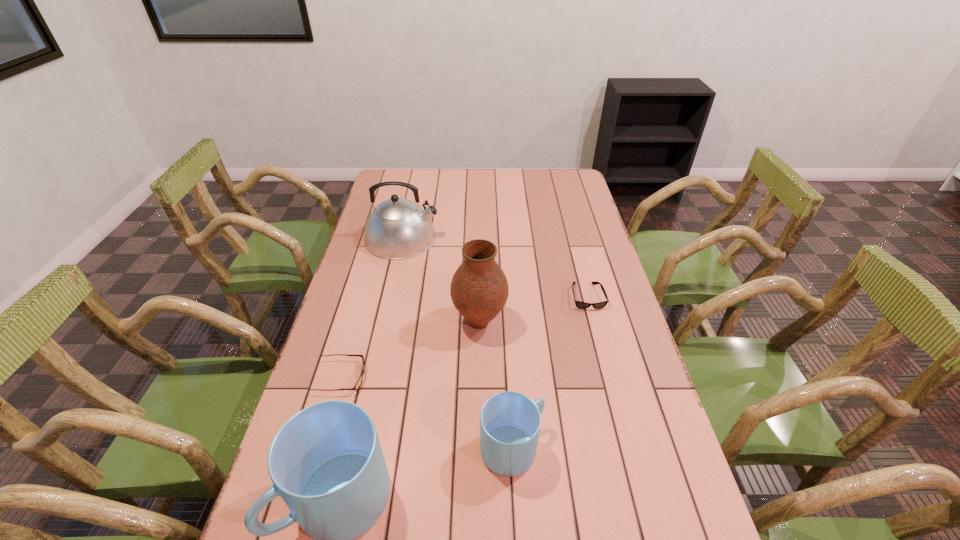
Image resolution: width=960 pixels, height=540 pixels. Find the location of `free spot between the nearer sunglasses and the fourth tallest object`. free spot between the nearer sunglasses and the fourth tallest object is located at coordinates (427, 413).

The image size is (960, 540). Identify the location of vacant area that lies between the vase and the third nearest object. (411, 350).

This screenshot has height=540, width=960. I want to click on vacant area that lies between the vase and the kettle, so click(441, 280).

Image resolution: width=960 pixels, height=540 pixels. I want to click on object that is the third closest one to the rightmost object, so click(x=398, y=228).

I want to click on object that is the third nearest to the left sunglasses, so click(510, 422).

Locate an element on the screen. free region that satisfies the following two spatial constraints: 1. from the spout of the right mug; 2. on the right side of the farthest object is located at coordinates (354, 449).

Locate an element on the screen. The image size is (960, 540). vacant region that satisfies the following two spatial constraints: 1. on the front-facing side of the fourth farthest object; 2. on the back side of the shorter mug is located at coordinates (322, 449).

You are a GUI agent. You are given a task and a screenshot of the screen. Output one action in this format:
    pyautogui.click(x=<x>, y=<y>)
    Task: Click on the vacant area that satisfies the following two spatial constraints: 1. on the front-facing side of the nearer sunglasses; 2. on the back side of the right mug
    
    Given the screenshot: What is the action you would take?
    pyautogui.click(x=322, y=449)

You are a GUI agent. You are given a task and a screenshot of the screen. Output one action in this format:
    pyautogui.click(x=<x>, y=<y>)
    Task: Click on the vacant space that satisfies the following two spatial constraints: 1. on the back side of the fourth tallest object; 2. on the front-facing side of the third nearest object
    
    Given the screenshot: What is the action you would take?
    tap(508, 377)

This screenshot has height=540, width=960. I want to click on blank space that satisfies the following two spatial constraints: 1. from the spout of the kettle; 2. on the right side of the shorter mug, so click(x=354, y=449).